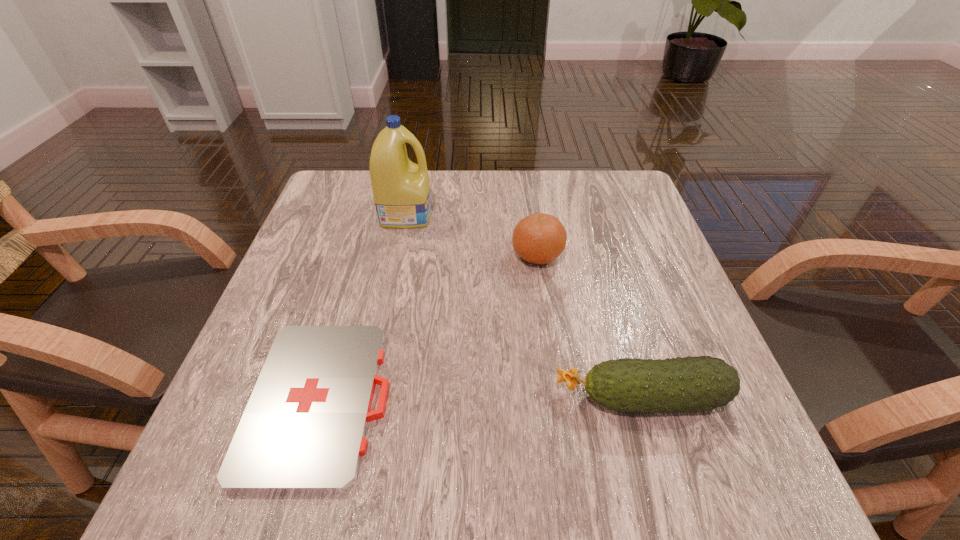
Identify the location of vacant area situated on handle side the shortest object. Image resolution: width=960 pixels, height=540 pixels. 627,401.

Where is `object located in the far edge section of the desktop`? Image resolution: width=960 pixels, height=540 pixels. object located in the far edge section of the desktop is located at coordinates (401, 189).

Where is `object that is at the near edge`? object that is at the near edge is located at coordinates (303, 430).

At what (x,y) coordinates should I click in order to perform the action: click on object that is at the left edge. Please return your answer as a coordinate pair (x, y). This screenshot has width=960, height=540. Looking at the image, I should click on (303, 430).

This screenshot has width=960, height=540. Find the location of `object positioned at the right edge`. object positioned at the right edge is located at coordinates (702, 383).

This screenshot has width=960, height=540. I want to click on object that is at the near left corner, so click(x=303, y=430).

The height and width of the screenshot is (540, 960). What are the coordinates of `vacant space at the far edge` in the screenshot? It's located at (481, 185).

Where is `free point at the left edge`? This screenshot has width=960, height=540. free point at the left edge is located at coordinates (310, 224).

This screenshot has width=960, height=540. Identify the location of vacant space at the right edge of the desktop. (617, 232).

Where is `blank space at the far right corner of the desktop`? This screenshot has width=960, height=540. blank space at the far right corner of the desktop is located at coordinates (618, 222).